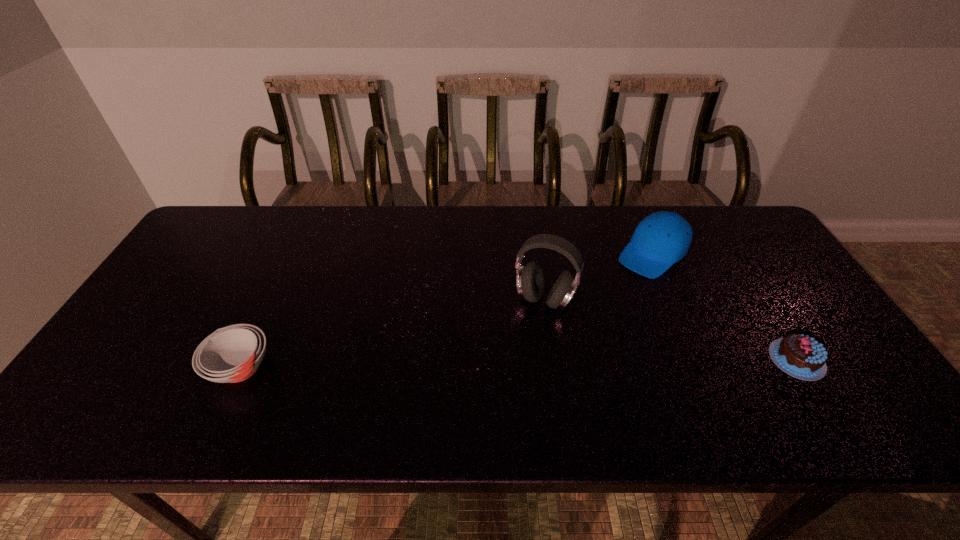
This screenshot has height=540, width=960. Find the location of `the leftmost object`. the leftmost object is located at coordinates (232, 354).

Find the location of a particular element. The image size is (960, 540). the rightmost object is located at coordinates (800, 356).

The width and height of the screenshot is (960, 540). In order to click on the third shortest object in this screenshot , I will do `click(663, 238)`.

Identify the location of cap. 663,238.

Image resolution: width=960 pixels, height=540 pixels. Find the location of `the second farthest object`. the second farthest object is located at coordinates (530, 282).

This screenshot has width=960, height=540. What are the coordinates of `the tallest object` in the screenshot? It's located at [530, 282].

You are a GUI agent. You are given a task and a screenshot of the screen. Output one action in this format:
    pyautogui.click(x=<x>, y=<y>)
    Task: Click on the vacant region located on the right of the soup bowl
    The width and height of the screenshot is (960, 540).
    Given the screenshot: What is the action you would take?
    pyautogui.click(x=336, y=367)

Image resolution: width=960 pixels, height=540 pixels. I want to click on vacant space located 0.150m on the left of the chocolate cake, so click(x=708, y=360).

The width and height of the screenshot is (960, 540). Find the location of `vacant area located on the front-facing side of the farthest object`. vacant area located on the front-facing side of the farthest object is located at coordinates (590, 311).

Where is `vacant region located 0.300m on the front-facing side of the farthest object`? vacant region located 0.300m on the front-facing side of the farthest object is located at coordinates (572, 328).